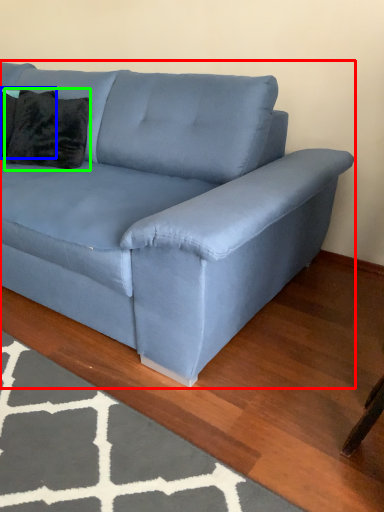
Question: Based on their relative distances, which object is farther from studio couch (highlighted by a red box)? Choose from pillow (highlighted by a blue box) and pillow (highlighted by a green box).

Choices:
 (A) pillow
 (B) pillow

Answer: (A)